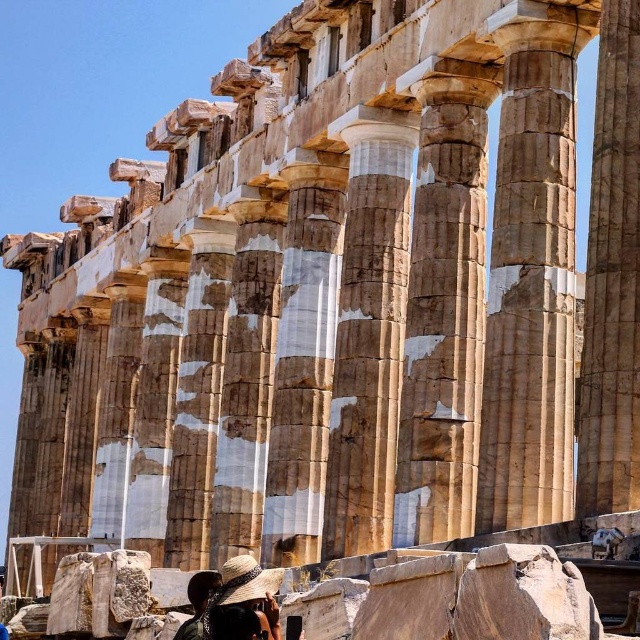
You are standing at the base of the Parthenon and want to take a photo that includes both the point at coordinates point [220,589] and point [176,634]. Which point should you position closer to the camera to ensure both are in the frame?

To ensure both points are in the frame, you should position the camera closer to point [220,589] since it is in front of point [176,634]. This way, the point that is farther back will still be visible in the background.

You are a tourist visiting the Parthenon and notice a matte straw hat at lower center and a dark brown hair at lower center. Which object is located to the right of the other?

The matte straw hat at lower center is positioned on the right side of dark brown hair at lower center.

You are standing in front of the Parthenon and notice a matte straw hat at lower center. Based on its position, can you estimate whether it is closer to the base of the Parthenon or the sky?

The matte straw hat at lower center is located at point coordinates suggesting it is closer to the base of the Parthenon rather than the sky.